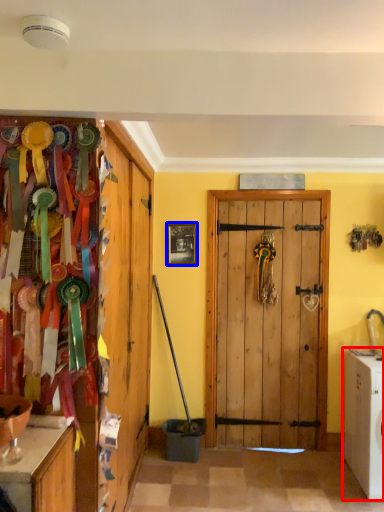
Question: Among these objects, which one is nearest to the camera, washing machine (highlighted by a red box) or picture frame (highlighted by a blue box)?

Choices:
 (A) washing machine
 (B) picture frame

Answer: (A)